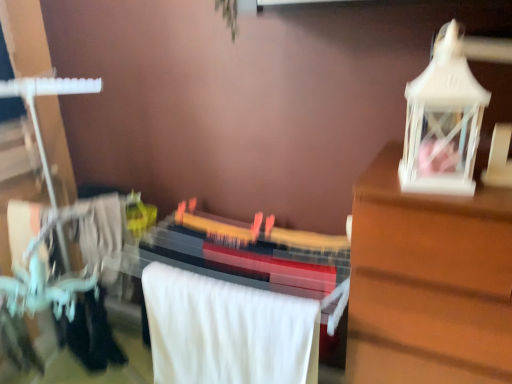
Question: Is matte black guitar at center oriented towards white soft towel at center?

Choices:
 (A) yes
 (B) no

Answer: (A)

Question: Is matte black guitar at center smaller than white soft towel at center?

Choices:
 (A) no
 (B) yes

Answer: (A)

Question: Considering the relative sizes of matte black guitar at center and white soft towel at center in the image provided, is matte black guitar at center shorter than white soft towel at center?

Choices:
 (A) no
 (B) yes

Answer: (A)

Question: From the image's perspective, is matte black guitar at center on top of white soft towel at center?

Choices:
 (A) yes
 (B) no

Answer: (B)

Question: Is matte black guitar at center to the right of white soft towel at center from the viewer's perspective?

Choices:
 (A) no
 (B) yes

Answer: (B)

Question: Would you say matte black guitar at center contains white soft towel at center?

Choices:
 (A) yes
 (B) no

Answer: (A)

Question: Does white plastic lantern at upper right have a greater height compared to white soft towel at center?

Choices:
 (A) yes
 (B) no

Answer: (B)

Question: Is white plastic lantern at upper right looking in the opposite direction of white soft towel at center?

Choices:
 (A) yes
 (B) no

Answer: (B)

Question: Is white plastic lantern at upper right aimed at white soft towel at center?

Choices:
 (A) yes
 (B) no

Answer: (B)

Question: Can you confirm if white plastic lantern at upper right is wider than white soft towel at center?

Choices:
 (A) yes
 (B) no

Answer: (A)

Question: Considering the relative sizes of white plastic lantern at upper right and white soft towel at center in the image provided, is white plastic lantern at upper right thinner than white soft towel at center?

Choices:
 (A) yes
 (B) no

Answer: (B)

Question: From a real-world perspective, is white plastic lantern at upper right physically below white soft towel at center?

Choices:
 (A) yes
 (B) no

Answer: (B)

Question: Is matte black guitar at center taller than white plastic lantern at upper right?

Choices:
 (A) yes
 (B) no

Answer: (A)